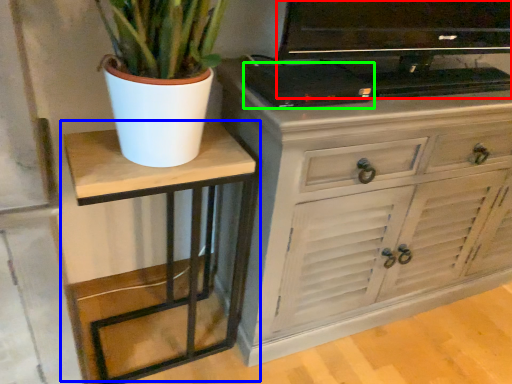
Question: Considering the real-world distances, which object is farthest from television (highlighted by a red box)? table (highlighted by a blue box) or appliance (highlighted by a green box)?

Choices:
 (A) table
 (B) appliance

Answer: (A)